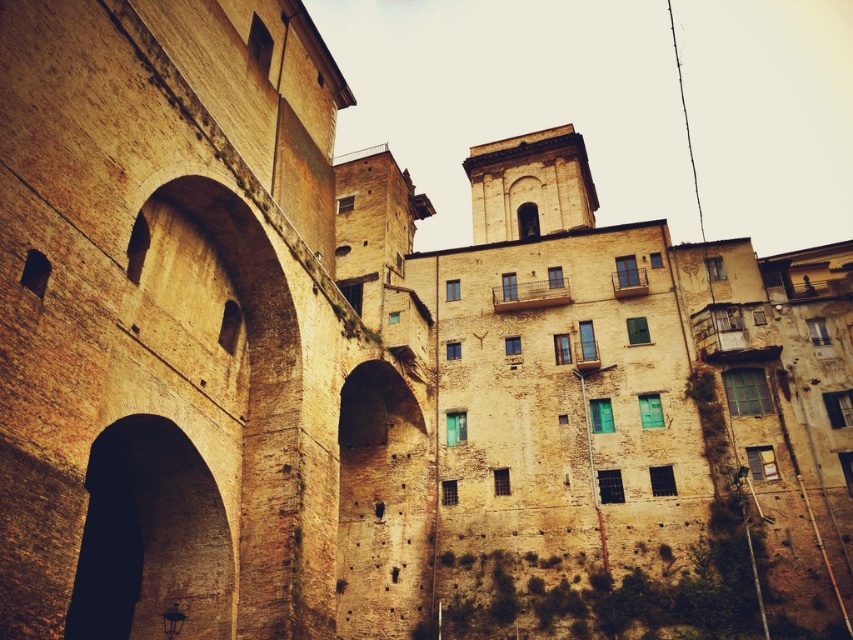
You are standing in front of the historic building and notice two points marked on its facade. The first point is at coordinates point (109, 468) and the second is at point (396, 452). Which of these points is closer to your current position?

Point (109, 468) is closer to the camera than point (396, 452), so the first point is closer to your current position.

You are an architect analyzing the building structure. You see the dark stone archway at lower left and the brown rough stone archway at center. Which archway has a greater height?

The brown rough stone archway at center is taller than the dark stone archway at lower left.

You are standing in front of the historic building described in the scene. There is a dark stone archway at lower left located at point (149, 538). If you want to enter through this archway, which direction should you move relative to your current position?

The dark stone archway at lower left is located at point (149, 538), so you should move towards the lower left direction to enter through it.